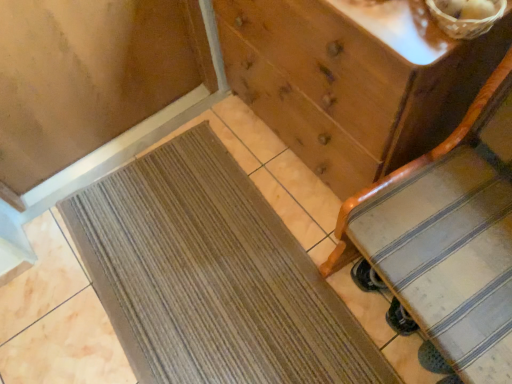
Locate an element on the screen. This screenshot has width=512, height=384. free space above brown woven mat at lower left (from a real-world perspective) is located at coordinates (202, 267).